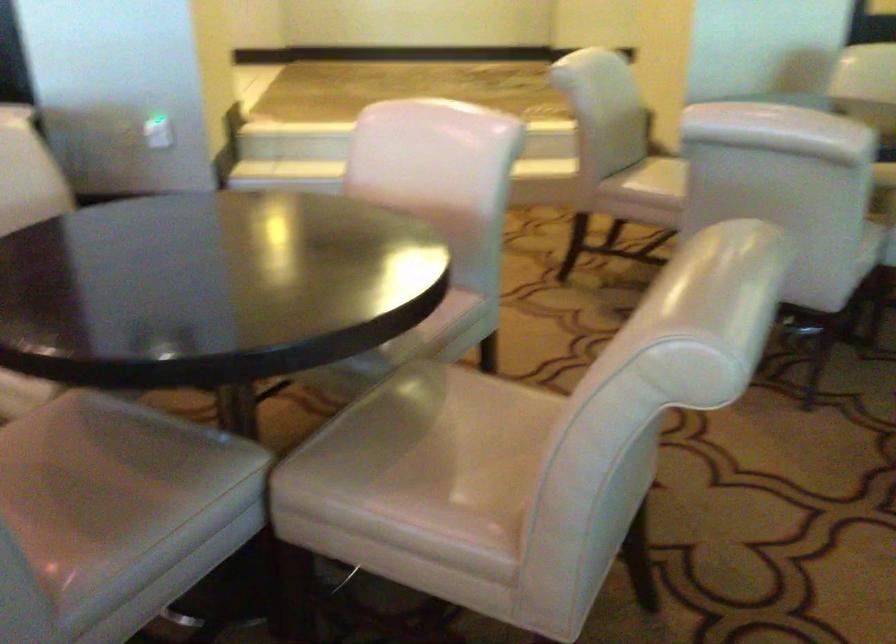
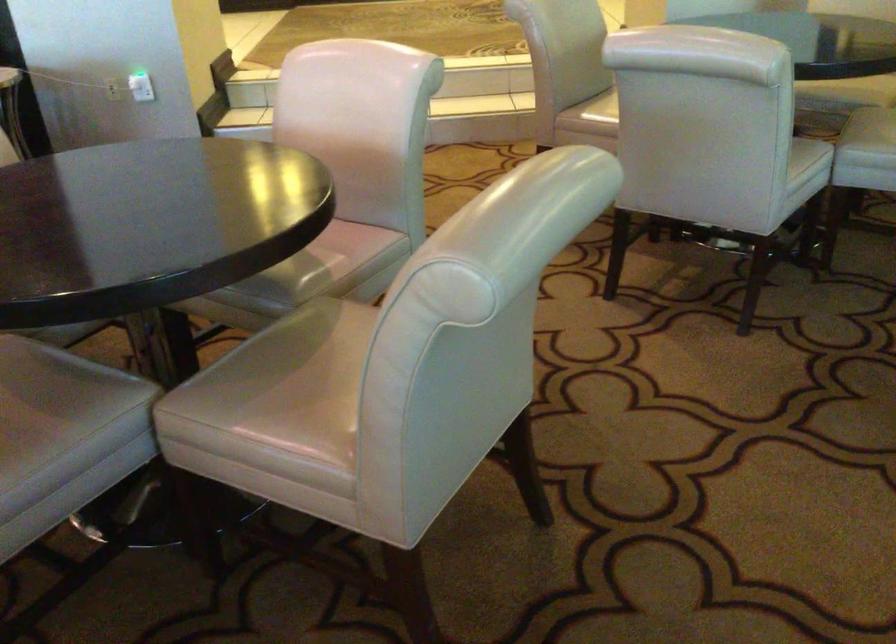
Where in the second image is the point corresponding to point (156, 455) from the first image?

(56, 389)